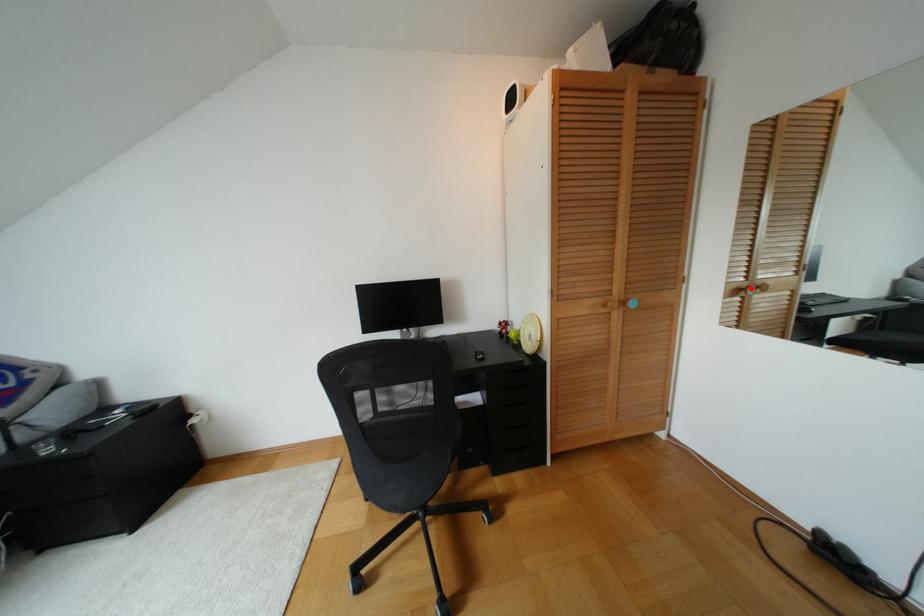
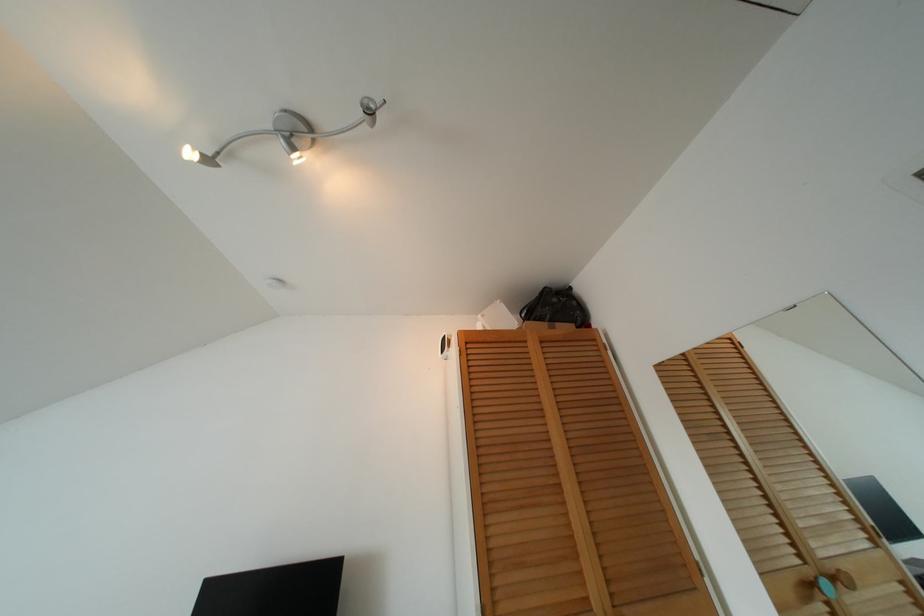
Question: I am providing you with two images of the same scene from different viewpoints. In image1, a red point is highlighted. Considering the same 3D point in image2, which of the following is correct?

Choices:
 (A) It is closer
 (B) It is farther

Answer: (A)